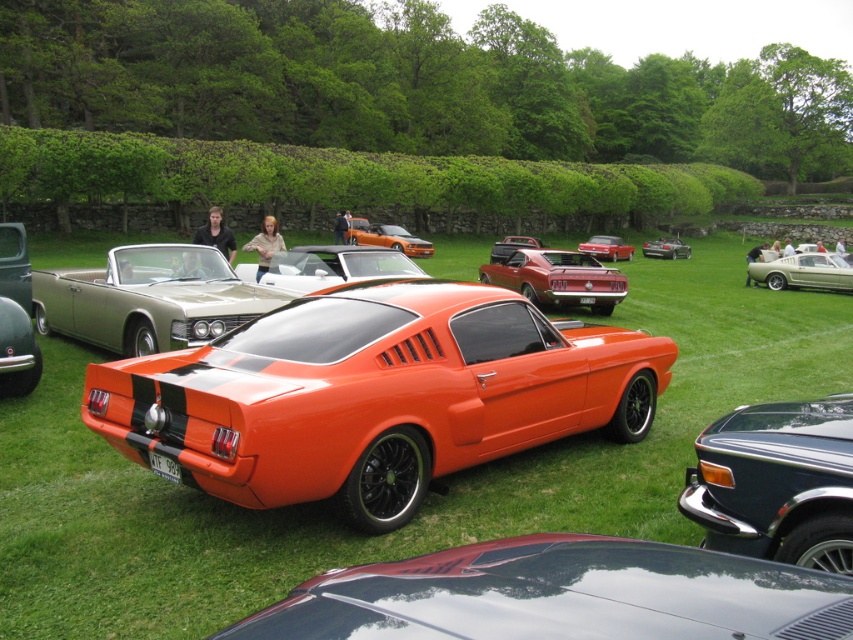
Between point (389, 589) and point (677, 241), which one is positioned in front?

Point (389, 589)

Can you confirm if glossy metallic car at center is shorter than metallic silver convertible at center?

Indeed, glossy metallic car at center has a lesser height compared to metallic silver convertible at center.

What are the coordinates of `glossy metallic car at center` in the screenshot? It's located at (561, 595).

Is point (183, 362) closer to camera compared to point (670, 244)?

Yes, point (183, 362) is closer to viewer.

Which of these two, orange matte sports car at center or metallic silver convertible at center, stands shorter?

orange matte sports car at center

Between point (120, 444) and point (680, 253), which one is positioned in front?

Point (120, 444)

Identify the location of orange matte sports car at center. (373, 396).

Can you confirm if white glossy convertible at center is taller than shiny orange convertible at center?

Indeed, white glossy convertible at center has a greater height compared to shiny orange convertible at center.

Can you confirm if white glossy convertible at center is wider than shiny orange convertible at center?

Yes, white glossy convertible at center is wider than shiny orange convertible at center.

Does point (267, 273) come closer to viewer compared to point (358, 220)?

Yes, point (267, 273) is closer to viewer.

Find the location of a particular element. Image resolution: width=853 pixels, height=640 pixels. white glossy convertible at center is located at coordinates (335, 266).